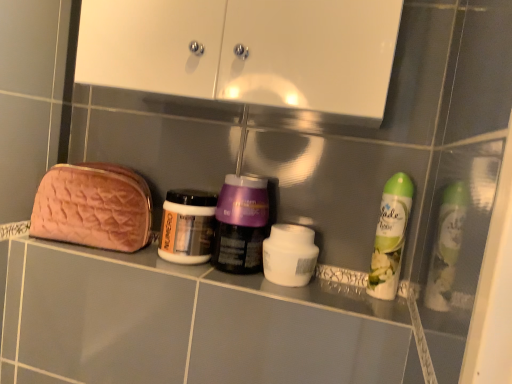
What do you see at coordinates (289, 255) in the screenshot?
I see `white matte jar at center` at bounding box center [289, 255].

Image resolution: width=512 pixels, height=384 pixels. Identify the location of white matte jar at center. (289, 255).

From a real-world perspective, is white glossy cabinet at upper center below pink quilted pouch at left?

No, from a real-world perspective, white glossy cabinet at upper center is not under pink quilted pouch at left.

Between white glossy cabinet at upper center and pink quilted pouch at left, which one has more height?

With more height is white glossy cabinet at upper center.

From the image's perspective, which one is positioned higher, white glossy cabinet at upper center or pink quilted pouch at left?

white glossy cabinet at upper center appears higher in the image.

Is pink quilted pouch at left facing away from purple glossy jar at center, which ranks as the second bottle in right-to-left order?

No.

Considering the relative sizes of pink quilted pouch at left and purple glossy jar at center, which ranks as the second bottle in right-to-left order, in the image provided, is pink quilted pouch at left bigger than purple glossy jar at center, which ranks as the second bottle in right-to-left order,?

Yes, pink quilted pouch at left is bigger than purple glossy jar at center, which ranks as the second bottle in right-to-left order.

From the image's perspective, is pink quilted pouch at left below purple glossy jar at center, arranged as the second bottle when viewed from the left?

No, from the image's perspective, pink quilted pouch at left is not beneath purple glossy jar at center, arranged as the second bottle when viewed from the left.

How different are the orientations of white matte jar at center and pink quilted pouch at left in degrees?

1.05 degrees.

Can you confirm if white matte jar at center is thinner than pink quilted pouch at left?

Correct, the width of white matte jar at center is less than that of pink quilted pouch at left.

Which of these two, white matte jar at center or pink quilted pouch at left, is bigger?

With larger size is pink quilted pouch at left.

Is pink quilted pouch at left positioned with its back to white glossy cabinet at upper center?

No, pink quilted pouch at left is not facing the opposite direction of white glossy cabinet at upper center.

Based on the photo, how different are the orientations of pink quilted pouch at left and white glossy cabinet at upper center in degrees?

1.29 degrees.

Is pink quilted pouch at left taller or shorter than white glossy cabinet at upper center?

Clearly, pink quilted pouch at left is shorter compared to white glossy cabinet at upper center.

Which of these two, pink quilted pouch at left or white glossy cabinet at upper center, is bigger?

Bigger between the two is white glossy cabinet at upper center.

From the image's perspective, relative to pink quilted pouch at left, is purple glossy jar at center, which ranks as the second bottle in right-to-left order, above or below?

purple glossy jar at center, which ranks as the second bottle in right-to-left order, is below pink quilted pouch at left.

Consider the image. Is purple glossy jar at center, arranged as the second bottle when viewed from the left, aimed at pink quilted pouch at left?

No.

Can you confirm if purple glossy jar at center, arranged as the second bottle when viewed from the left, is thinner than pink quilted pouch at left?

Yes.

Consider the image. From a real-world perspective, between white matte air freshener at right, positioned as the 1th bottle in right-to-left order, and metallic silver jar at center, which is counted as the first bottle, starting from the left, who is vertically higher?

In real-world perspective, white matte air freshener at right, positioned as the 1th bottle in right-to-left order, is above.

What's the angular difference between white matte air freshener at right, acting as the third bottle starting from the left, and metallic silver jar at center, which is counted as the first bottle, starting from the left,'s facing directions?

13.3 degrees.

Is white matte air freshener at right, positioned as the 1th bottle in right-to-left order, facing towards metallic silver jar at center, which ranks as the 3th bottle in right-to-left order?

No, white matte air freshener at right, positioned as the 1th bottle in right-to-left order, is not turned towards metallic silver jar at center, which ranks as the 3th bottle in right-to-left order.

Based on the photo, is white matte air freshener at right, acting as the third bottle starting from the left, in contact with pink quilted pouch at left?

No, white matte air freshener at right, acting as the third bottle starting from the left, is not with pink quilted pouch at left.

Based on the photo, does white matte air freshener at right, acting as the third bottle starting from the left, turn towards pink quilted pouch at left?

No, white matte air freshener at right, acting as the third bottle starting from the left, is not turned towards pink quilted pouch at left.

From the image's perspective, who appears lower, white matte air freshener at right, positioned as the 1th bottle in right-to-left order, or pink quilted pouch at left?

From the image's view, white matte air freshener at right, positioned as the 1th bottle in right-to-left order, is below.

What are the coordinates of `pouch that appears below the white matte air freshener at right, acting as the third bottle starting from the left (from a real-world perspective)` in the screenshot? It's located at (93, 207).

The width and height of the screenshot is (512, 384). Identify the location of pouch below the white glossy cabinet at upper center (from the image's perspective). (93, 207).

The height and width of the screenshot is (384, 512). In order to click on pouch located underneath the purple glossy jar at center, arranged as the second bottle when viewed from the left (from a real-world perspective) in this screenshot , I will do `click(93, 207)`.

From the image, which object appears to be farther from purple glossy jar at center, arranged as the second bottle when viewed from the left, white matte air freshener at right, acting as the third bottle starting from the left, or white glossy cabinet at upper center?

white glossy cabinet at upper center lies further to purple glossy jar at center, arranged as the second bottle when viewed from the left, than the other object.

Which object lies further to the anchor point white matte jar at center, white glossy cabinet at upper center or metallic silver jar at center, which ranks as the 3th bottle in right-to-left order?

white glossy cabinet at upper center is further to white matte jar at center.

From the image, which object appears to be nearer to purple glossy jar at center, arranged as the second bottle when viewed from the left, white matte jar at center or metallic silver jar at center, which is counted as the first bottle, starting from the left?

The object closer to purple glossy jar at center, arranged as the second bottle when viewed from the left, is metallic silver jar at center, which is counted as the first bottle, starting from the left.

Based on their spatial positions, is white matte air freshener at right, positioned as the 1th bottle in right-to-left order, or metallic silver jar at center, which ranks as the 3th bottle in right-to-left order, further from pink quilted pouch at left?

The object further to pink quilted pouch at left is white matte air freshener at right, positioned as the 1th bottle in right-to-left order.

Based on their spatial positions, is white matte jar at center or metallic silver jar at center, which ranks as the 3th bottle in right-to-left order, further from white glossy cabinet at upper center?

Among the two, white matte jar at center is located further to white glossy cabinet at upper center.

From the image, which object appears to be nearer to pink quilted pouch at left, white matte jar at center or purple glossy jar at center, which ranks as the second bottle in right-to-left order?

purple glossy jar at center, which ranks as the second bottle in right-to-left order, lies closer to pink quilted pouch at left than the other object.

Considering their positions, is metallic silver jar at center, which is counted as the first bottle, starting from the left, positioned closer to white matte jar at center than pink quilted pouch at left?

Based on the image, metallic silver jar at center, which is counted as the first bottle, starting from the left, appears to be nearer to white matte jar at center.

Looking at this image, from the image, which object appears to be farther from white glossy cabinet at upper center, white matte jar at center or purple glossy jar at center, which ranks as the second bottle in right-to-left order?

Among the two, white matte jar at center is located further to white glossy cabinet at upper center.

Locate an element on the screen. Image resolution: width=512 pixels, height=384 pixels. medicine cabinet between metallic silver jar at center, which is counted as the first bottle, starting from the left, and white matte air freshener at right, acting as the third bottle starting from the left, in the horizontal direction is located at coordinates (247, 52).

I want to click on bottle located between metallic silver jar at center, which is counted as the first bottle, starting from the left, and white matte jar at center in the left-right direction, so click(x=241, y=224).

I want to click on toiletry between metallic silver jar at center, which is counted as the first bottle, starting from the left, and white matte air freshener at right, positioned as the 1th bottle in right-to-left order, so click(x=289, y=255).

Where is `toiletry between pink quilted pouch at left and white matte air freshener at right, acting as the third bottle starting from the left, in the horizontal direction`? The height and width of the screenshot is (384, 512). toiletry between pink quilted pouch at left and white matte air freshener at right, acting as the third bottle starting from the left, in the horizontal direction is located at coordinates (289, 255).